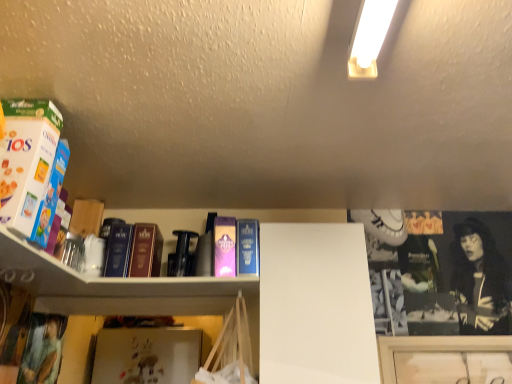
Describe the element at coordinates (248, 247) in the screenshot. I see `hardcover book at center, the second paperback book when ordered from left to right` at that location.

What is the approximate height of blue cardboard cereal box at left, positioned as the 1th book in front-to-back order?

It is 15.28 inches.

Describe the element at coordinates (145, 251) in the screenshot. I see `satin burgundy book at center, the 3th book positioned from the front` at that location.

Find the location of `hardcover book at center, which ranks as the 4th book in front-to-back order`. hardcover book at center, which ranks as the 4th book in front-to-back order is located at coordinates (118, 249).

The image size is (512, 384). Describe the element at coordinates (118, 249) in the screenshot. I see `hardcover book at center, which ranks as the 4th book in front-to-back order` at that location.

At what (x,y) coordinates should I click in order to perform the action: click on matte purple book at left, the 3th book when ordered from back to front. Please return your answer as a coordinate pair (x, y). Image resolution: width=512 pixels, height=384 pixels. Looking at the image, I should click on (51, 196).

Is there a large distance between hardcover book at center, the second paperback book when ordered from left to right, and satin burgundy book at center, acting as the 2th book starting from the back?

hardcover book at center, the second paperback book when ordered from left to right, is near satin burgundy book at center, acting as the 2th book starting from the back, not far away.

Which object is positioned more to the right, hardcover book at center, the second paperback book when ordered from left to right, or satin burgundy book at center, acting as the 2th book starting from the back?

hardcover book at center, the second paperback book when ordered from left to right, is more to the right.

Between hardcover book at center, which is the first paperback book in right-to-left order, and satin burgundy book at center, acting as the 2th book starting from the back, which one is positioned behind?

satin burgundy book at center, acting as the 2th book starting from the back, is more distant.

Consider the image. Is satin burgundy book at center, acting as the 2th book starting from the back, positioned with its back to blue cardboard cereal box at left, positioned as the 1th book in front-to-back order?

No.

Looking at their sizes, would you say satin burgundy book at center, the 3th book positioned from the front, is wider or thinner than blue cardboard cereal box at left, positioned as the 1th book in front-to-back order?

satin burgundy book at center, the 3th book positioned from the front, is thinner than blue cardboard cereal box at left, positioned as the 1th book in front-to-back order.

Which is less distant, (255, 274) or (231, 219)?

Point (255, 274) is closer to the camera than point (231, 219).

How different are the orientations of hardcover book at center, which is the first paperback book in right-to-left order, and purple matte paperback book at center, positioned as the second paperback book in right-to-left order, in degrees?

hardcover book at center, which is the first paperback book in right-to-left order, and purple matte paperback book at center, positioned as the second paperback book in right-to-left order, are facing 0.561 degrees away from each other.

Image resolution: width=512 pixels, height=384 pixels. Identify the location of paperback book on the left of hardcover book at center, which is the first paperback book in right-to-left order. (225, 247).

Considering the relative sizes of hardcover book at center, which is the first paperback book in right-to-left order, and purple matte paperback book at center, the first paperback book positioned from the left, in the image provided, is hardcover book at center, which is the first paperback book in right-to-left order, bigger than purple matte paperback book at center, the first paperback book positioned from the left,?

Actually, hardcover book at center, which is the first paperback book in right-to-left order, might be smaller than purple matte paperback book at center, the first paperback book positioned from the left.

Does hardcover book at center, which is the first paperback book in right-to-left order, come in front of hardcover book at center, which ranks as the 4th book in front-to-back order?

Yes, it is in front of hardcover book at center, which ranks as the 4th book in front-to-back order.

From the image's perspective, between hardcover book at center, which is the first paperback book in right-to-left order, and hardcover book at center, which is counted as the 1th book, starting from the back, who is located below?

hardcover book at center, which is counted as the 1th book, starting from the back.

From the picture: Between hardcover book at center, the second paperback book when ordered from left to right, and hardcover book at center, which ranks as the 4th book in front-to-back order, which one appears on the right side from the viewer's perspective?

Positioned to the right is hardcover book at center, the second paperback book when ordered from left to right.

In the scene shown: From a real-world perspective, which object rests below the other?

In real-world perspective, hardcover book at center, which ranks as the 4th book in front-to-back order, is lower.

You are a GUI agent. You are given a task and a screenshot of the screen. Output one action in this format:
    pyautogui.click(x=<x>, y=<y>)
    Task: Click on the 2nd book positioned below the blue cardboard cereal box at left, which appears as the fourth book when viewed from the back (from a real-world perspective)
    
    Given the screenshot: What is the action you would take?
    pyautogui.click(x=118, y=249)

Is blue cardboard cereal box at left, which appears as the fourth book when viewed from the back, spatially inside hardcover book at center, which is counted as the 1th book, starting from the back, or outside of it?

blue cardboard cereal box at left, which appears as the fourth book when viewed from the back, cannot be found inside hardcover book at center, which is counted as the 1th book, starting from the back.

Does blue cardboard cereal box at left, positioned as the 1th book in front-to-back order, have a greater width compared to hardcover book at center, which is counted as the 1th book, starting from the back?

Yes, blue cardboard cereal box at left, positioned as the 1th book in front-to-back order, is wider than hardcover book at center, which is counted as the 1th book, starting from the back.

Is blue cardboard cereal box at left, which appears as the fourth book when viewed from the back, bigger or smaller than hardcover book at center, which ranks as the 4th book in front-to-back order?

In the image, blue cardboard cereal box at left, which appears as the fourth book when viewed from the back, appears to be larger than hardcover book at center, which ranks as the 4th book in front-to-back order.

In the scene shown: From a real-world perspective, between hardcover book at center, which ranks as the 4th book in front-to-back order, and purple matte paperback book at center, the first paperback book positioned from the left, who is vertically higher?

purple matte paperback book at center, the first paperback book positioned from the left.

Could you tell me if hardcover book at center, which ranks as the 4th book in front-to-back order, is turned towards purple matte paperback book at center, the first paperback book positioned from the left?

No.

Is hardcover book at center, which ranks as the 4th book in front-to-back order, inside or outside of purple matte paperback book at center, the first paperback book positioned from the left?

The correct answer is: outside.

Which is closer to the camera, (127, 224) or (220, 230)?

Point (127, 224) is farther from the camera than point (220, 230).

Is hardcover book at center, which ranks as the 4th book in front-to-back order, a part of purple matte paperback book at center, positioned as the second paperback book in right-to-left order?

No, hardcover book at center, which ranks as the 4th book in front-to-back order, is not inside purple matte paperback book at center, positioned as the second paperback book in right-to-left order.

Which is nearer, (223,229) or (121,230)?

Point (223,229) appears to be closer to the viewer than point (121,230).

Locate an element on the screen. The height and width of the screenshot is (384, 512). the 2nd paperback book above the hardcover book at center, which is counted as the 1th book, starting from the back (from the image's perspective) is located at coordinates (225, 247).

From a real-world perspective, is purple matte paperback book at center, the first paperback book positioned from the left, physically above hardcover book at center, which ranks as the 4th book in front-to-back order?

Yes, from a real-world perspective, purple matte paperback book at center, the first paperback book positioned from the left, is over hardcover book at center, which ranks as the 4th book in front-to-back order

Image resolution: width=512 pixels, height=384 pixels. I want to click on the 1st book to the left of the hardcover book at center, the second paperback book when ordered from left to right, starting your count from the anchor, so click(145, 251).

Which book is the 2nd one when counting from the right side of the blue cardboard cereal box at left, positioned as the 1th book in front-to-back order? Please provide its 2D coordinates.

[(145, 251)]

When comparing their distances from matte purple book at left, which is the 2th book in front-to-back order, does satin burgundy book at center, the 3th book positioned from the front, or blue cardboard cereal box at left, which appears as the fourth book when viewed from the back, seem further?

satin burgundy book at center, the 3th book positioned from the front.

Looking at the image, which one is located closer to blue cardboard cereal box at left, which appears as the fourth book when viewed from the back, satin burgundy book at center, acting as the 2th book starting from the back, or matte purple book at left, the 3th book when ordered from back to front?

matte purple book at left, the 3th book when ordered from back to front, is positioned closer to the anchor blue cardboard cereal box at left, which appears as the fourth book when viewed from the back.

When comparing their distances from satin burgundy book at center, acting as the 2th book starting from the back, does matte purple book at left, the 3th book when ordered from back to front, or purple matte paperback book at center, the first paperback book positioned from the left, seem further?

matte purple book at left, the 3th book when ordered from back to front, is further to satin burgundy book at center, acting as the 2th book starting from the back.

Based on their spatial positions, is satin burgundy book at center, the 3th book positioned from the front, or hardcover book at center, which is counted as the 1th book, starting from the back, closer to hardcover book at center, which is the first paperback book in right-to-left order?

satin burgundy book at center, the 3th book positioned from the front.

Based on their spatial positions, is hardcover book at center, the second paperback book when ordered from left to right, or satin burgundy book at center, acting as the 2th book starting from the back, further from purple matte paperback book at center, positioned as the second paperback book in right-to-left order?

→ satin burgundy book at center, acting as the 2th book starting from the back, lies further to purple matte paperback book at center, positioned as the second paperback book in right-to-left order, than the other object.

Estimate the real-world distances between objects in this image. Which object is closer to hardcover book at center, which ranks as the 4th book in front-to-back order, hardcover book at center, the second paperback book when ordered from left to right, or purple matte paperback book at center, positioned as the second paperback book in right-to-left order?

The object closer to hardcover book at center, which ranks as the 4th book in front-to-back order, is purple matte paperback book at center, positioned as the second paperback book in right-to-left order.

Looking at the image, which one is located further to matte purple book at left, which is the 2th book in front-to-back order, purple matte paperback book at center, the first paperback book positioned from the left, or hardcover book at center, which ranks as the 4th book in front-to-back order?

purple matte paperback book at center, the first paperback book positioned from the left, is further to matte purple book at left, which is the 2th book in front-to-back order.

When comparing their distances from purple matte paperback book at center, positioned as the second paperback book in right-to-left order, does hardcover book at center, the second paperback book when ordered from left to right, or blue cardboard cereal box at left, positioned as the 1th book in front-to-back order, seem closer?

Among the two, hardcover book at center, the second paperback book when ordered from left to right, is located nearer to purple matte paperback book at center, positioned as the second paperback book in right-to-left order.

Find the location of `paperback book situated between matte purple book at left, the 3th book when ordered from back to front, and hardcover book at center, which is the first paperback book in right-to-left order, from left to right`. paperback book situated between matte purple book at left, the 3th book when ordered from back to front, and hardcover book at center, which is the first paperback book in right-to-left order, from left to right is located at coordinates (225, 247).

This screenshot has width=512, height=384. What are the coordinates of `book between hardcover book at center, which ranks as the 4th book in front-to-back order, and purple matte paperback book at center, positioned as the second paperback book in right-to-left order` in the screenshot? It's located at (145, 251).

Find the location of a particular element. paperback book between hardcover book at center, which ranks as the 4th book in front-to-back order, and hardcover book at center, the second paperback book when ordered from left to right, from left to right is located at coordinates (225, 247).

Find the location of a particular element. paperback book situated between blue cardboard cereal box at left, which appears as the fourth book when viewed from the back, and hardcover book at center, the second paperback book when ordered from left to right, from left to right is located at coordinates (225, 247).